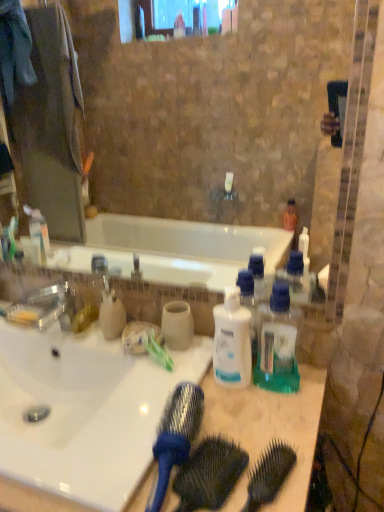
Identify the location of vacant space positioned to the left of blue plastic brush at center, which appears as the 1th brush when viewed from the left. (97, 466).